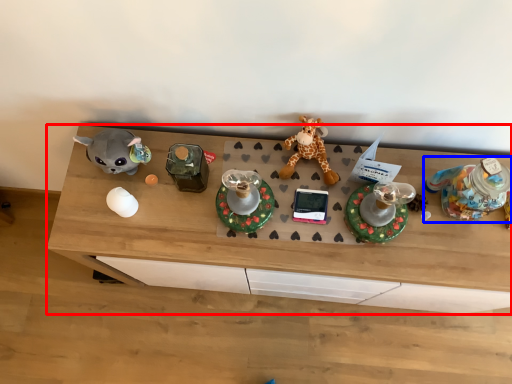
Question: Among these objects, which one is farthest to the camera, desk (highlighted by a red box) or toy (highlighted by a blue box)?

Choices:
 (A) desk
 (B) toy

Answer: (A)